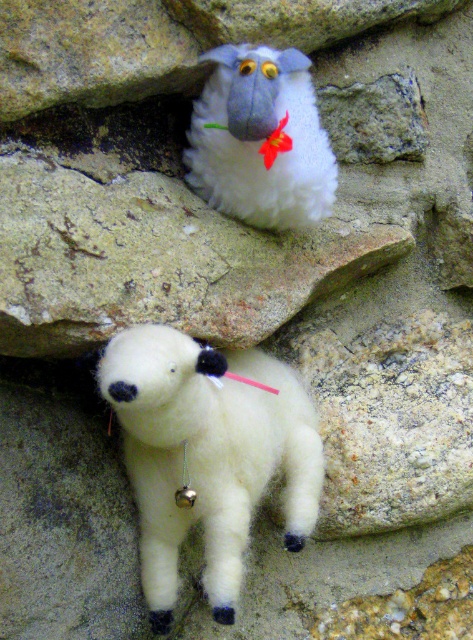
Question: Which of the following is the farthest from the observer?

Choices:
 (A) (120, 372)
 (B) (280, 196)

Answer: (B)

Question: Can you confirm if white fluffy lamb at lower center is bigger than white fluffy sheep at upper center?

Choices:
 (A) yes
 (B) no

Answer: (A)

Question: Can you confirm if white fluffy lamb at lower center is smaller than white fluffy sheep at upper center?

Choices:
 (A) yes
 (B) no

Answer: (B)

Question: Can you confirm if white fluffy lamb at lower center is positioned to the right of white fluffy sheep at upper center?

Choices:
 (A) no
 (B) yes

Answer: (A)